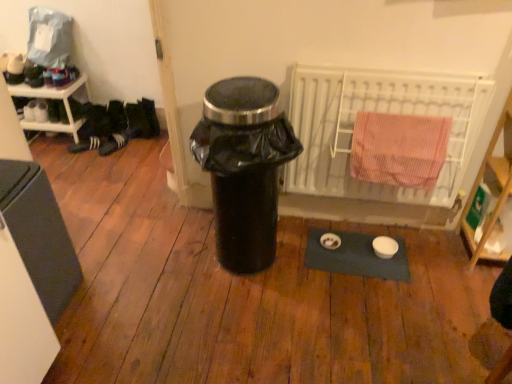
Question: Considering the relative positions of white metal radiator at upper right and matte gray refrigerator at left in the image provided, is white metal radiator at upper right to the right of matte gray refrigerator at left from the viewer's perspective?

Choices:
 (A) yes
 (B) no

Answer: (A)

Question: From the image's perspective, is white metal radiator at upper right above matte gray refrigerator at left?

Choices:
 (A) no
 (B) yes

Answer: (B)

Question: Considering the relative sizes of white metal radiator at upper right and matte gray refrigerator at left in the image provided, is white metal radiator at upper right taller than matte gray refrigerator at left?

Choices:
 (A) no
 (B) yes

Answer: (B)

Question: From the image's perspective, is white metal radiator at upper right beneath matte gray refrigerator at left?

Choices:
 (A) no
 (B) yes

Answer: (A)

Question: From a real-world perspective, is white metal radiator at upper right under matte gray refrigerator at left?

Choices:
 (A) yes
 (B) no

Answer: (B)

Question: From a real-world perspective, relative to wooden shelf at right, which ranks as the 1th shelf in right-to-left order, is white metal radiator at upper right vertically above or below?

Choices:
 (A) below
 (B) above

Answer: (B)

Question: Does point (314, 180) appear closer or farther from the camera than point (510, 168)?

Choices:
 (A) closer
 (B) farther

Answer: (B)

Question: Is white metal radiator at upper right spatially inside wooden shelf at right, which is counted as the 2th shelf, starting from the left, or outside of it?

Choices:
 (A) outside
 (B) inside

Answer: (A)

Question: In the image, is white metal radiator at upper right on the left side or the right side of wooden shelf at right, which appears as the 2th shelf when viewed from the top?

Choices:
 (A) left
 (B) right

Answer: (A)

Question: From a real-world perspective, is wooden shelf at right, the first shelf when ordered from bottom to top, physically located above or below white plastic shelf at left, the second shelf viewed from the right?

Choices:
 (A) below
 (B) above

Answer: (B)

Question: Is wooden shelf at right, which appears as the 2th shelf when viewed from the top, to the left or to the right of white plastic shelf at left, the 2th shelf from the front, in the image?

Choices:
 (A) right
 (B) left

Answer: (A)

Question: Considering their positions, is wooden shelf at right, which ranks as the 1th shelf in right-to-left order, located in front of or behind white plastic shelf at left, the first shelf when ordered from back to front?

Choices:
 (A) behind
 (B) front

Answer: (B)

Question: From the image's perspective, is wooden shelf at right, which ranks as the 1th shelf in right-to-left order, located above or below white plastic shelf at left, which is the first shelf in top-to-bottom order?

Choices:
 (A) below
 (B) above

Answer: (A)

Question: Is white textured shoe at left, which is the first shoe from right to left, taller or shorter than matte gray refrigerator at left?

Choices:
 (A) tall
 (B) short

Answer: (B)

Question: Considering the positions of white textured shoe at left, which appears as the 2th shoe when viewed from the left, and matte gray refrigerator at left in the image, is white textured shoe at left, which appears as the 2th shoe when viewed from the left, wider or thinner than matte gray refrigerator at left?

Choices:
 (A) thin
 (B) wide

Answer: (A)